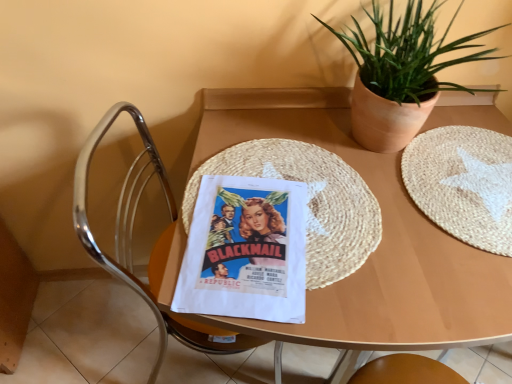
Locate an element on the screen. The width and height of the screenshot is (512, 384). blank space above matte paper poster at center (from a real-world perspective) is located at coordinates (252, 243).